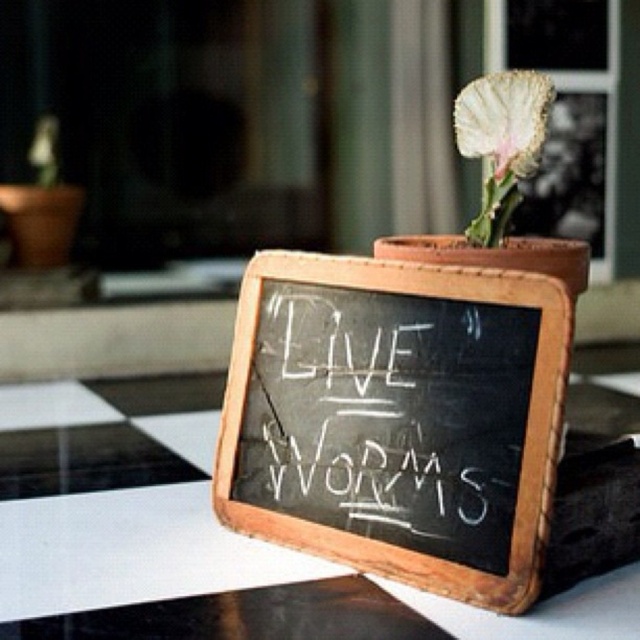
Does black glass table at center appear under white chalk writing at center?

Correct, black glass table at center is located below white chalk writing at center.

This screenshot has width=640, height=640. Describe the element at coordinates (202, 536) in the screenshot. I see `black glass table at center` at that location.

Does point (627, 408) come behind point (384, 348)?

Yes.

Locate an element on the screen. black glass table at center is located at coordinates (202, 536).

Who is positioned more to the left, black chalkboard at center or white chalk writing at center?

From the viewer's perspective, white chalk writing at center appears more on the left side.

Which of these two, black chalkboard at center or white chalk writing at center, stands shorter?

white chalk writing at center is shorter.

Who is more distant from viewer, (275, 474) or (326, 426)?

The point (275, 474) is behind.

Identify the location of black chalkboard at center. The image size is (640, 640). (397, 419).

Can you confirm if white chalk writing at center is positioned to the right of white textured leaf at upper center?

In fact, white chalk writing at center is to the left of white textured leaf at upper center.

Between white chalk writing at center and white textured leaf at upper center, which one has less height?

Standing shorter between the two is white textured leaf at upper center.

Who is more distant from viewer, (x=401, y=312) or (x=529, y=122)?

Point (x=529, y=122)

The height and width of the screenshot is (640, 640). Find the location of `white chalk writing at center`. white chalk writing at center is located at coordinates (376, 413).